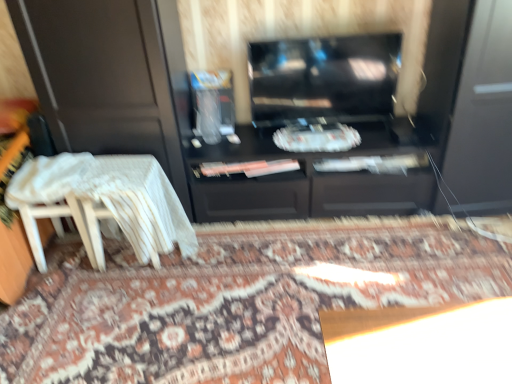
Question: Considering their positions, is white lace table at lower left located in front of or behind clear plastic container at center?

Choices:
 (A) front
 (B) behind

Answer: (A)

Question: From the image's perspective, is white lace table at lower left positioned above or below clear plastic container at center?

Choices:
 (A) below
 (B) above

Answer: (A)

Question: Based on their relative distances, which object is farther from the white wood chair at left?

Choices:
 (A) white lace table at lower left
 (B) clear plastic container at center
 (C) patterned carpet at center
 (D) glossy black tv at center

Answer: (D)

Question: Which object is positioned farthest from the white wood chair at left?

Choices:
 (A) clear plastic container at center
 (B) white lace table at lower left
 (C) patterned carpet at center
 (D) glossy black tv at center

Answer: (D)